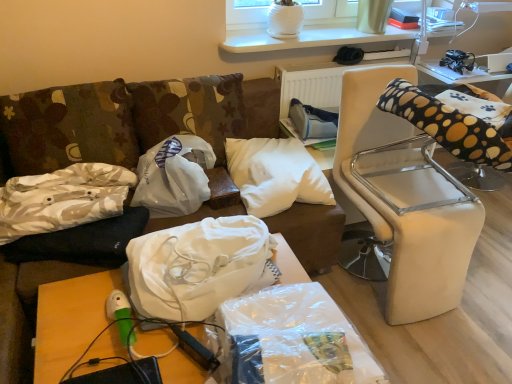
Question: Is white fabric bag at center, which is the 2th material from front to back, outside of clear plastic bag at lower center, which ranks as the 1th material in front-to-back order?

Choices:
 (A) yes
 (B) no

Answer: (A)

Question: Is the position of white fabric bag at center, which is the 2th material in back-to-front order, more distant than that of clear plastic bag at lower center, which ranks as the 1th material in front-to-back order?

Choices:
 (A) yes
 (B) no

Answer: (A)

Question: From a real-world perspective, is white fabric bag at center, which is the 2th material in back-to-front order, on clear plastic bag at lower center, which ranks as the 1th material in front-to-back order?

Choices:
 (A) yes
 (B) no

Answer: (A)

Question: Considering the relative sizes of white fabric bag at center, which is the 2th material in back-to-front order, and clear plastic bag at lower center, the 3th material viewed from the back, in the image provided, is white fabric bag at center, which is the 2th material in back-to-front order, taller than clear plastic bag at lower center, the 3th material viewed from the back,?

Choices:
 (A) yes
 (B) no

Answer: (A)

Question: Can you confirm if white fabric bag at center, which is the 2th material from front to back, is bigger than clear plastic bag at lower center, which ranks as the 1th material in front-to-back order?

Choices:
 (A) no
 (B) yes

Answer: (B)

Question: Choose the correct answer: Is white leather chair at right inside wooden table at lower left, acting as the second table starting from the right, or outside it?

Choices:
 (A) outside
 (B) inside

Answer: (A)

Question: From the image's perspective, is white leather chair at right positioned above or below wooden table at lower left, acting as the 1th table starting from the bottom?

Choices:
 (A) below
 (B) above

Answer: (B)

Question: Relative to wooden table at lower left, the first table in the front-to-back sequence, is white leather chair at right in front or behind?

Choices:
 (A) behind
 (B) front

Answer: (A)

Question: Is white leather chair at right bigger or smaller than wooden table at lower left, which is counted as the first table, starting from the left?

Choices:
 (A) big
 (B) small

Answer: (A)

Question: Would you say white soft pillow at center, which is counted as the first pillow, starting from the right, is to the left or to the right of white plastic bag at center, placed as the third material when sorted from front to back, in the picture?

Choices:
 (A) left
 (B) right

Answer: (B)

Question: Is white soft pillow at center, acting as the 3th pillow starting from the left, spatially inside white plastic bag at center, which is the 1th material in back-to-front order, or outside of it?

Choices:
 (A) outside
 (B) inside

Answer: (A)

Question: From the image's perspective, is white soft pillow at center, acting as the 3th pillow starting from the left, above or below white plastic bag at center, placed as the third material when sorted from front to back?

Choices:
 (A) above
 (B) below

Answer: (A)

Question: Considering the positions of white soft pillow at center, which is counted as the first pillow, starting from the right, and white plastic bag at center, placed as the third material when sorted from front to back, in the image, is white soft pillow at center, which is counted as the first pillow, starting from the right, bigger or smaller than white plastic bag at center, placed as the third material when sorted from front to back,?

Choices:
 (A) big
 (B) small

Answer: (A)

Question: Choose the correct answer: Is camouflage fabric pillow at left, positioned as the 3th pillow in right-to-left order, inside clear plastic table at upper right, the second table in the left-to-right sequence, or outside it?

Choices:
 (A) outside
 (B) inside

Answer: (A)

Question: Is camouflage fabric pillow at left, positioned as the 3th pillow in right-to-left order, bigger or smaller than clear plastic table at upper right, the second table in the left-to-right sequence?

Choices:
 (A) small
 (B) big

Answer: (B)